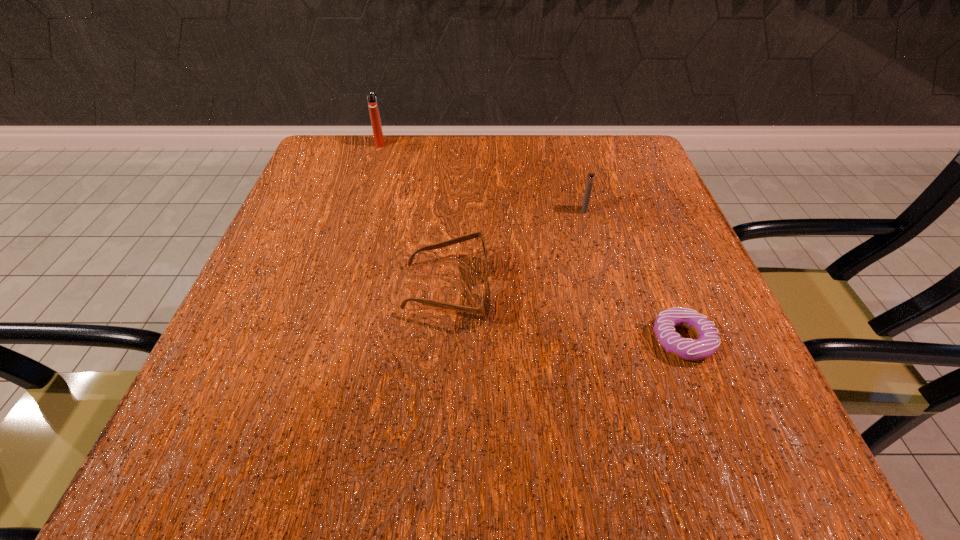
Where is `the left igniter`? the left igniter is located at coordinates click(372, 101).

Where is `the taller igniter`? The width and height of the screenshot is (960, 540). the taller igniter is located at coordinates (372, 101).

Locate an element on the screen. Image resolution: width=960 pixels, height=540 pixels. the second object from right to left is located at coordinates (590, 178).

Locate an element on the screen. This screenshot has width=960, height=540. the nearer igniter is located at coordinates (590, 178).

Where is `sunglasses`? This screenshot has width=960, height=540. sunglasses is located at coordinates (485, 306).

At what (x,y) coordinates should I click in order to perform the action: click on the third tallest object. Please return your answer as a coordinate pair (x, y). Image resolution: width=960 pixels, height=540 pixels. Looking at the image, I should click on (485, 306).

Identify the location of doughnut. (708, 341).

This screenshot has width=960, height=540. What are the coordinates of `the shortest object` in the screenshot? It's located at (708, 341).

Where is `vacant area located on the right of the taller igniter`? This screenshot has height=540, width=960. vacant area located on the right of the taller igniter is located at coordinates (554, 143).

The height and width of the screenshot is (540, 960). Find the location of `free space located on the back of the nearer igniter`. free space located on the back of the nearer igniter is located at coordinates (564, 137).